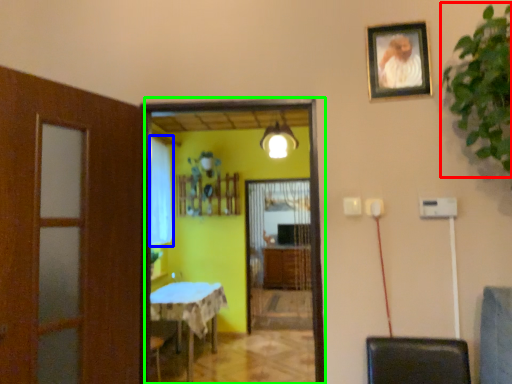
Question: Based on their relative distances, which object is nearer to plant (highlighted by a red box)? Choose from curtain (highlighted by a blue box) and screen door (highlighted by a green box).

Choices:
 (A) curtain
 (B) screen door

Answer: (B)